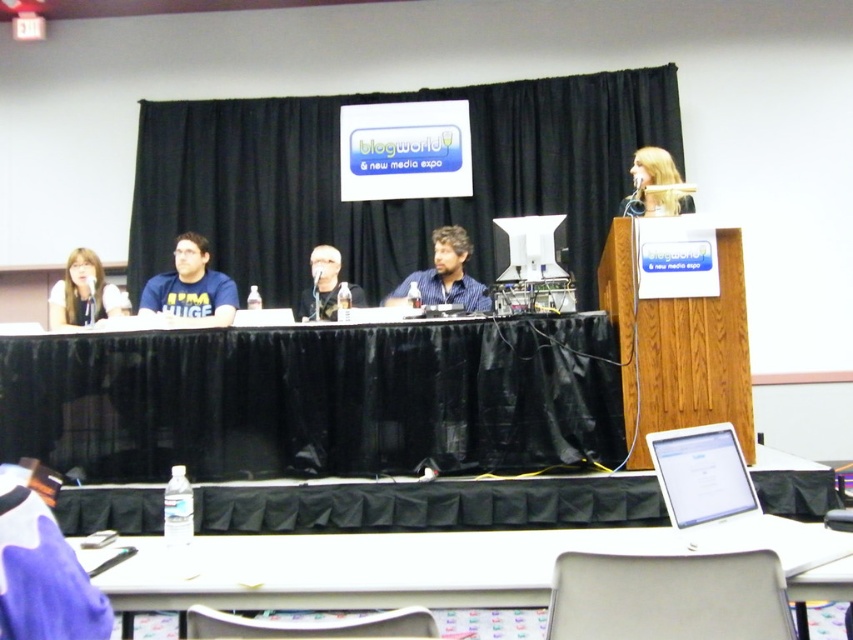
You are a photographer positioned at the silver metallic laptop at lower right and want to take a photo of the matte black microphone at center. Given that your camera has a maximum focus range of 2 meters, will you be able to capture the microphone clearly?

The silver metallic laptop at lower right is 2.84 meters from the matte black microphone at center. Since the distance exceeds the camera maximum focus range of 2 meters, the photographer will not be able to capture the microphone clearly.

You are organizing a panel discussion and need to ensure that the white plastic table at lower center is positioned at least 2.5 meters away from the blonde hair at upper right for safety reasons. Based on the image provided, is the current distance sufficient?

The white plastic table at lower center is 2.49 meters from blonde hair at upper right, which is just shy of the required 2.5 meters. The distance is insufficient to meet the safety requirement.